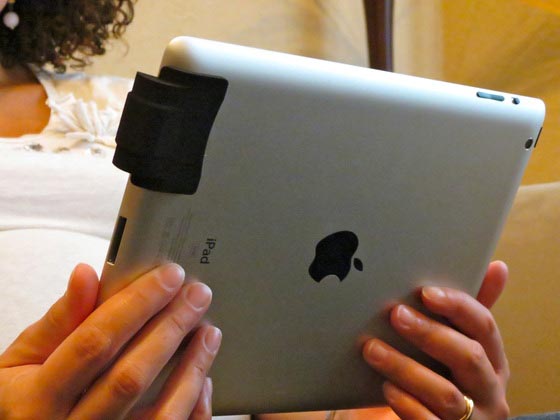
At what (x,y) coordinates should I click in order to perform the action: click on ipad. Please return your answer as a coordinate pair (x, y). This screenshot has height=420, width=560. Looking at the image, I should click on (367, 160).